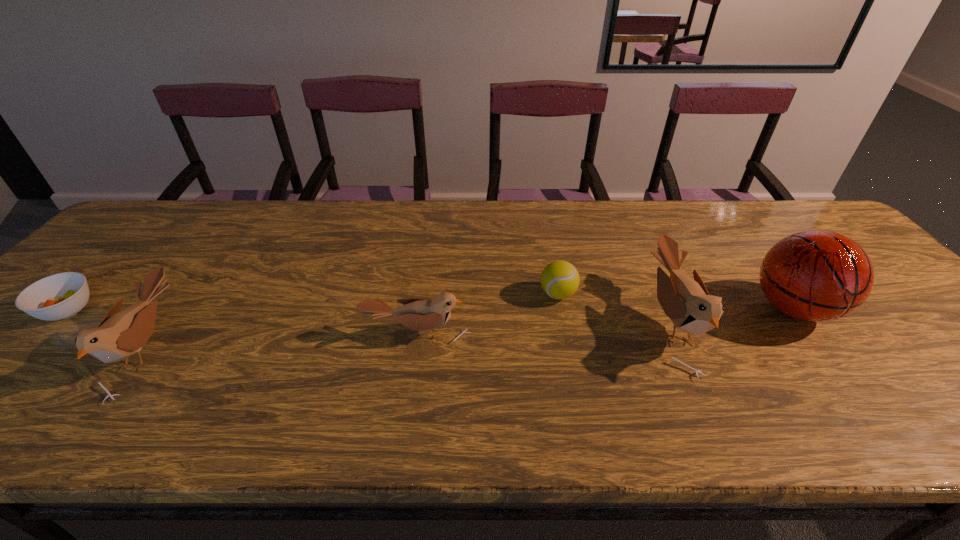
Image resolution: width=960 pixels, height=540 pixels. Identify the location of free location that satisfies the following two spatial constraints: 1. at the beak of the shortest bird; 2. at the beak of the leftmost bird. tap(415, 348).

Identify the location of free spot that satisfies the following two spatial constraints: 1. on the front side of the third object from right to left; 2. at the beak of the leftmost bird. This screenshot has height=540, width=960. (568, 348).

I want to click on free location that satisfies the following two spatial constraints: 1. at the beak of the third shortest object; 2. at the beak of the third tallest object, so click(415, 348).

You are a GUI agent. You are given a task and a screenshot of the screen. Output one action in this format:
    pyautogui.click(x=<x>, y=<y>)
    Task: Click on the free space that satisfies the following two spatial constraints: 1. on the side with spill of the basketball; 2. at the beak of the third tallest object
    The height and width of the screenshot is (540, 960).
    Given the screenshot: What is the action you would take?
    pyautogui.click(x=822, y=348)

You are a GUI agent. You are given a task and a screenshot of the screen. Output one action in this format:
    pyautogui.click(x=<x>, y=<y>)
    Task: Click on the vacant position in the image that satisfies the following two spatial constraints: 1. on the front side of the tennis ball; 2. at the beak of the third tallest object
    
    Given the screenshot: What is the action you would take?
    pyautogui.click(x=568, y=348)